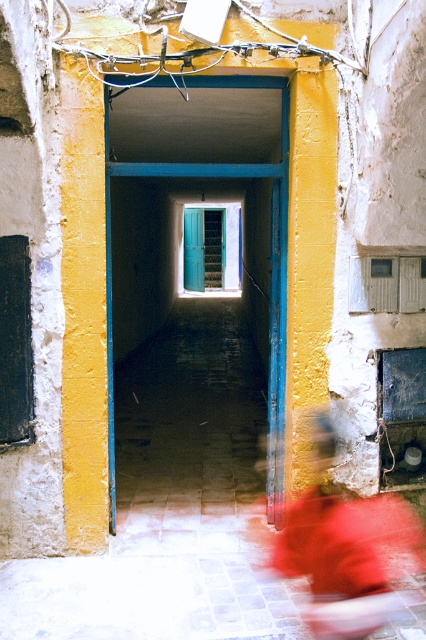
Looking at this image, is blue wooden door at center positioned at the back of teal wooden door at center?

That is False.

Which is more to the right, blue wooden door at center or teal wooden door at center?

From the viewer's perspective, blue wooden door at center appears more on the right side.

Does point (106, 106) come behind point (201, 236)?

No.

Where is `blue wooden door at center`? blue wooden door at center is located at coordinates (275, 266).

Is red fabric at lower right below blue wooden door at center?

Yes.

Can you confirm if red fabric at lower right is taller than blue wooden door at center?

No.

The height and width of the screenshot is (640, 426). What do you see at coordinates (348, 550) in the screenshot?
I see `red fabric at lower right` at bounding box center [348, 550].

This screenshot has width=426, height=640. I want to click on red fabric at lower right, so click(348, 550).

Which of these two, red fabric at lower right or teal wooden door at center, stands shorter?

red fabric at lower right

Between point (333, 588) and point (186, 288), which one is positioned in front?

Point (333, 588)

The height and width of the screenshot is (640, 426). Find the location of `red fabric at lower right`. red fabric at lower right is located at coordinates (348, 550).

The width and height of the screenshot is (426, 640). In order to click on red fabric at lower right in this screenshot , I will do `click(348, 550)`.